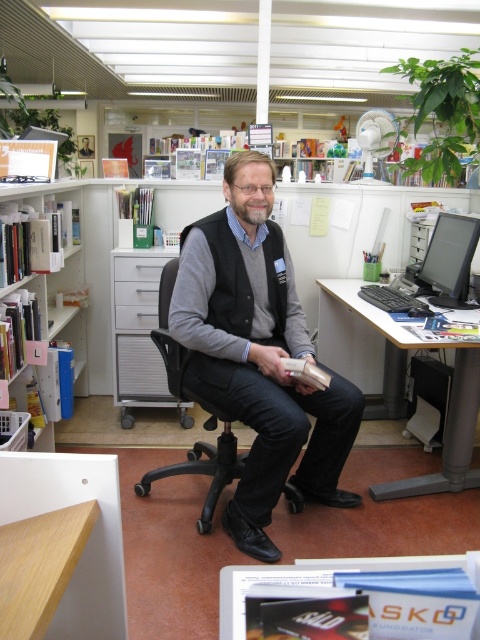
Between white plastic computer desk at right and white plastic bookshelf at left, which one appears on the left side from the viewer's perspective?

white plastic bookshelf at left is more to the left.

Who is more forward, (x=459, y=468) or (x=74, y=204)?

Point (x=459, y=468) is in front.

Who is more forward, (467, 426) or (72, 192)?

Positioned in front is point (467, 426).

Find the location of a particular element. Image resolution: width=480 pixels, height=640 pixels. white plastic computer desk at right is located at coordinates (448, 404).

Does gray wool vest at center have a greater width compared to white plastic computer desk at right?

Indeed, gray wool vest at center has a greater width compared to white plastic computer desk at right.

Where is `gray wool vest at center`? Image resolution: width=480 pixels, height=640 pixels. gray wool vest at center is located at coordinates (259, 355).

Is point (290, 435) positioned behind point (444, 486)?

No.

The height and width of the screenshot is (640, 480). In order to click on gray wool vest at center in this screenshot , I will do `click(259, 355)`.

Which is behind, point (346, 416) or point (78, 353)?

The point (78, 353) is more distant.

Is point (253, 161) positioned behind point (29, 186)?

No, (253, 161) is in front of (29, 186).

The height and width of the screenshot is (640, 480). In order to click on gray wool vest at center in this screenshot , I will do `click(259, 355)`.